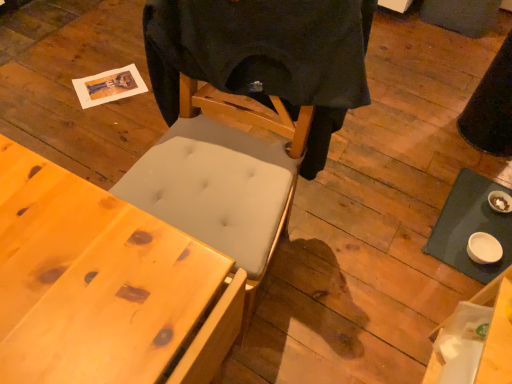
Image resolution: width=512 pixels, height=384 pixels. In order to click on free region under white matte table at lower right (from a real-world perspective) in this screenshot , I will do `click(467, 217)`.